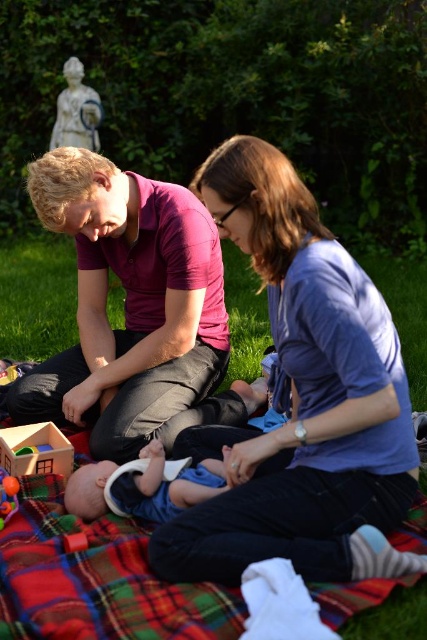
Question: Can you confirm if blue cotton shirt at center is positioned below rubberized plastic ball at center?

Choices:
 (A) no
 (B) yes

Answer: (A)

Question: Which of the following is the closest to the observer?

Choices:
 (A) white plastic bib at center
 (B) wooden house at lower left
 (C) wooden block at lower left
 (D) rubberized plastic ball at center

Answer: (C)

Question: Among these objects, which one is farthest from the camera?

Choices:
 (A) rubberized plastic ball at center
 (B) wooden house at lower left
 (C) white plastic bib at center
 (D) blue cotton shirt at center

Answer: (B)

Question: Is white plastic bib at center thinner than wooden house at lower left?

Choices:
 (A) yes
 (B) no

Answer: (B)

Question: Where is white plastic bib at center located in relation to rubberized plastic ball at center in the image?

Choices:
 (A) right
 (B) left

Answer: (A)

Question: Which object is positioned farthest from the rubberized plastic ball at center?

Choices:
 (A) blue cotton shirt at center
 (B) wooden block at lower left

Answer: (A)